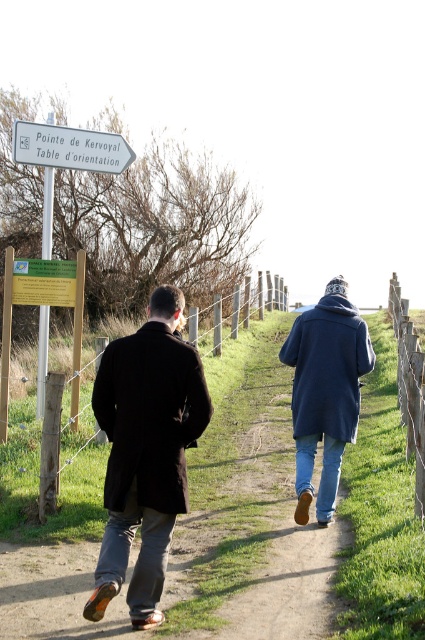
Question: Which object is the farthest from the green/yellow plastic sign at upper left?

Choices:
 (A) white plastic sign at upper center
 (B) wooden post at right
 (C) navy woolen sweater at center

Answer: (B)

Question: Which point is farther from the camera taking this photo?

Choices:
 (A) (45, 147)
 (B) (42, 292)

Answer: (A)

Question: Which point appears closest to the camera in this image?

Choices:
 (A) tap(317, 308)
 (B) tap(283, 356)

Answer: (A)

Question: Does dark wool coat at center appear over green/yellow plastic sign at upper left?

Choices:
 (A) no
 (B) yes

Answer: (A)

Question: Where is navy woolen sweater at center located in relation to white plastic sign at upper center in the image?

Choices:
 (A) right
 (B) left

Answer: (A)

Question: Can you confirm if dark wool coat at center is smaller than green/yellow plastic sign at upper left?

Choices:
 (A) no
 (B) yes

Answer: (A)